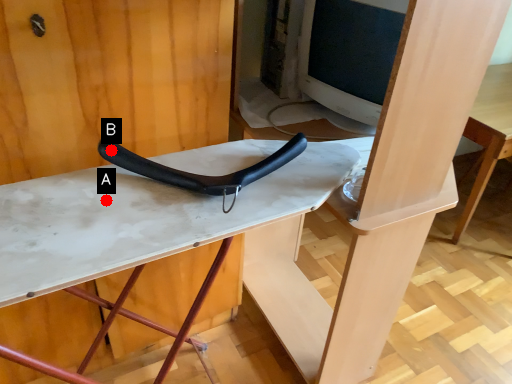
Question: Two points are circled on the image, labeled by A and B beside each circle. Which point appears closest to the camera in this image?

Choices:
 (A) A is closer
 (B) B is closer

Answer: (A)